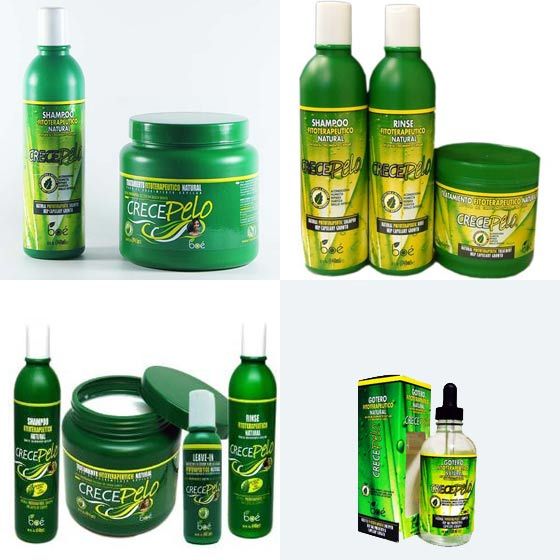
The width and height of the screenshot is (560, 560). In order to click on jars in this screenshot , I will do click(x=172, y=231), click(x=497, y=226), click(x=109, y=462), click(x=167, y=399).